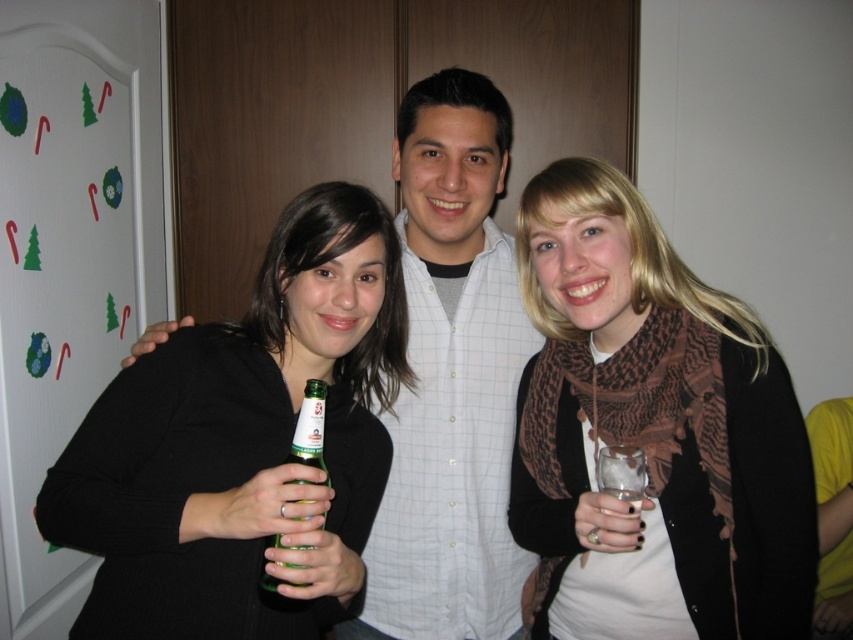
You are at a party and want to grab a drink without moving more than 16 inches. You see the green glass bottle at center and the clear glass at center. Which one can you reach first if you start from your current position?

The green glass bottle at center is 15.75 inches from clear glass at center, so you can reach the green glass bottle at center first since it is within the 16 inches distance.

You are trying to determine the relative sizes of the objects in the scene. Which object is bigger between the black matte shirt at left and the clear glass at center?

The black matte shirt at left is larger than the clear glass at center.

From the picture: You are taking a photo of the scene and want to focus on both point [267,584] and point [637,513]. Which point should you adjust your focus to first to ensure both are in clear view?

Point [267,584] is closer to the camera than point [637,513], so you should focus on point [267,584] first to ensure both are in clear view.